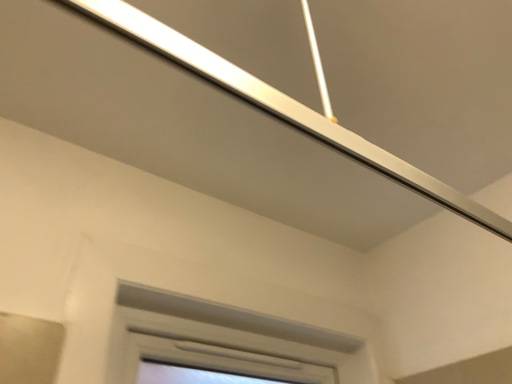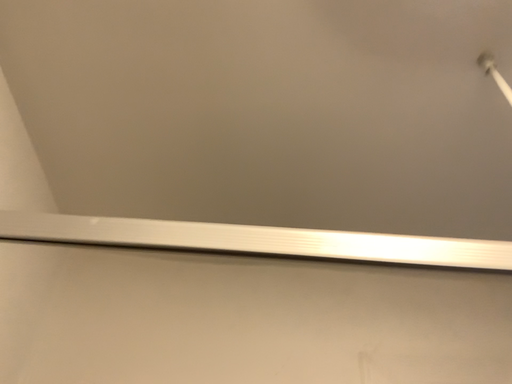
Question: How did the camera likely rotate when shooting the video?

Choices:
 (A) rotated left
 (B) rotated right

Answer: (A)